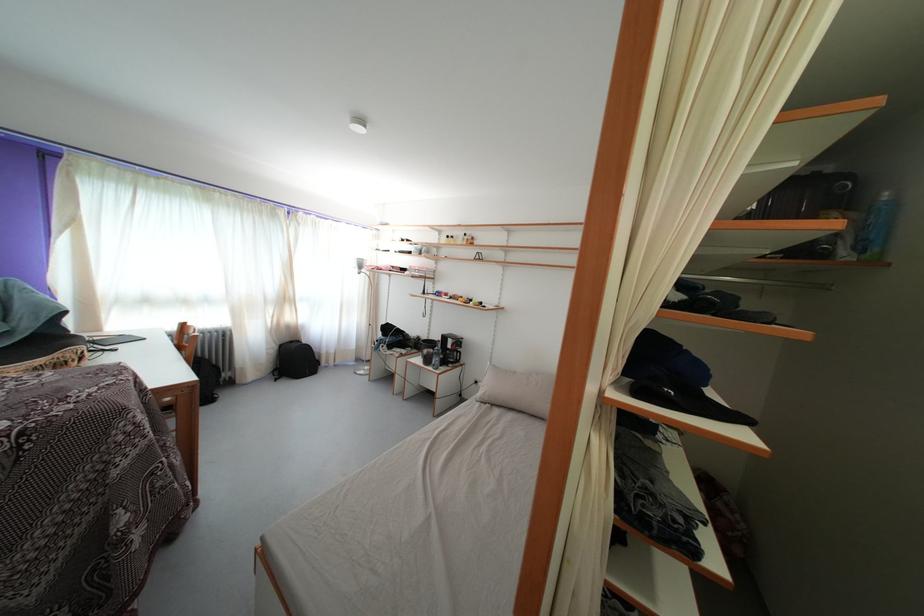
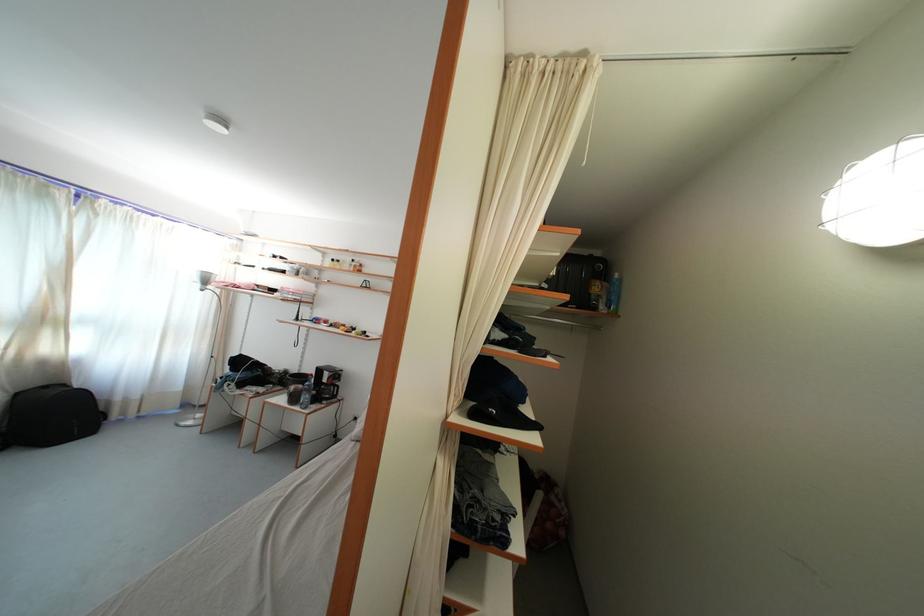
The point at (338, 358) is marked in the first image. Where is the corresponding point in the second image?

(141, 403)